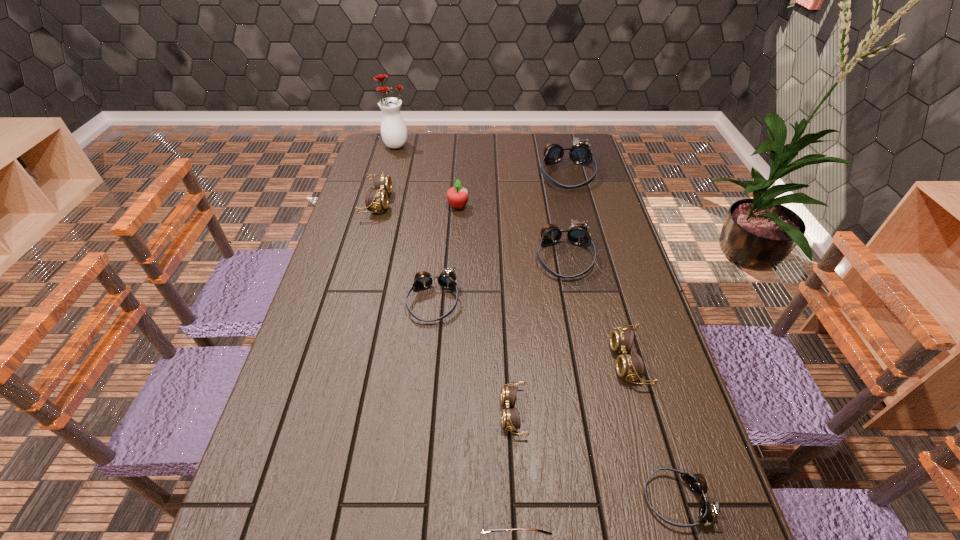
You are a GUI agent. You are given a task and a screenshot of the screen. Output one action in this format:
    pyautogui.click(x=<x>, y=<y>)
    Task: Click on the tallest object
    
    Given the screenshot: What is the action you would take?
    pyautogui.click(x=393, y=129)

The width and height of the screenshot is (960, 540). Identify the location of vase. (393, 129).

Find the location of a particular element. This screenshot has height=540, width=960. apple is located at coordinates (457, 196).

You are a GUI agent. You are given a task and a screenshot of the screen. Output one action in this format:
    pyautogui.click(x=<x>, y=<y>)
    Task: Click on the biggest bronze goggles
    
    Given the screenshot: What is the action you would take?
    pyautogui.click(x=580, y=153)

Locate an element on the screen. This screenshot has height=540, width=960. the biggest brown goggles is located at coordinates (377, 199).

The image size is (960, 540). In order to click on the farthest brown goggles in this screenshot , I will do `click(377, 199)`.

Locate an element on the screen. The width and height of the screenshot is (960, 540). the third smallest bronze goggles is located at coordinates (578, 235).

Locate an element on the screen. The width and height of the screenshot is (960, 540). the second smallest brown goggles is located at coordinates (631, 366).

Locate an element on the screen. The height and width of the screenshot is (540, 960). the leftmost bronze goggles is located at coordinates (447, 279).

Where is `the sixth goggles from right to left`? The width and height of the screenshot is (960, 540). the sixth goggles from right to left is located at coordinates (447, 279).